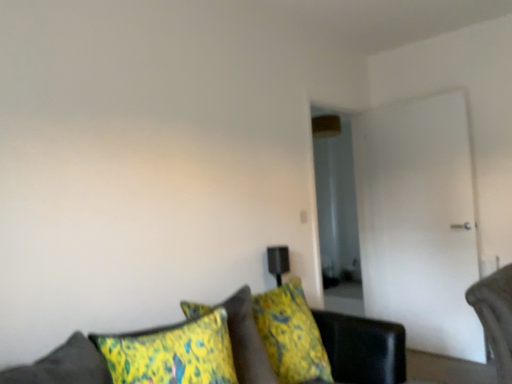
Question: Does white glossy door at right lie in front of yellow-green fabric pillow at lower center?

Choices:
 (A) yes
 (B) no

Answer: (B)

Question: Is the surface of white glossy door at right in direct contact with yellow-green fabric pillow at lower center?

Choices:
 (A) no
 (B) yes

Answer: (A)

Question: From the image's perspective, is white glossy door at right located above yellow-green fabric pillow at lower center?

Choices:
 (A) no
 (B) yes

Answer: (B)

Question: From a real-world perspective, is white glossy door at right positioned under yellow-green fabric pillow at lower center based on gravity?

Choices:
 (A) no
 (B) yes

Answer: (A)

Question: Does white glossy door at right have a greater width compared to yellow-green fabric pillow at lower center?

Choices:
 (A) yes
 (B) no

Answer: (B)

Question: Is white glossy door at right further to the viewer compared to yellow-green fabric pillow at lower center?

Choices:
 (A) no
 (B) yes

Answer: (B)

Question: Is velvet green couch at lower center closer to the viewer compared to yellow-green fabric pillow at lower center?

Choices:
 (A) yes
 (B) no

Answer: (A)

Question: From a real-world perspective, is velvet green couch at lower center physically above yellow-green fabric pillow at lower center?

Choices:
 (A) yes
 (B) no

Answer: (B)

Question: Is velvet green couch at lower center looking in the opposite direction of yellow-green fabric pillow at lower center?

Choices:
 (A) yes
 (B) no

Answer: (B)

Question: Is velvet green couch at lower center further to the viewer compared to yellow-green fabric pillow at lower center?

Choices:
 (A) no
 (B) yes

Answer: (A)

Question: From the image's perspective, would you say velvet green couch at lower center is positioned over yellow-green fabric pillow at lower center?

Choices:
 (A) no
 (B) yes

Answer: (A)

Question: From the image's perspective, is velvet green couch at lower center beneath yellow-green fabric pillow at lower center?

Choices:
 (A) yes
 (B) no

Answer: (A)

Question: Does velvet green couch at lower center have a lesser height compared to white glossy door at right?

Choices:
 (A) yes
 (B) no

Answer: (A)